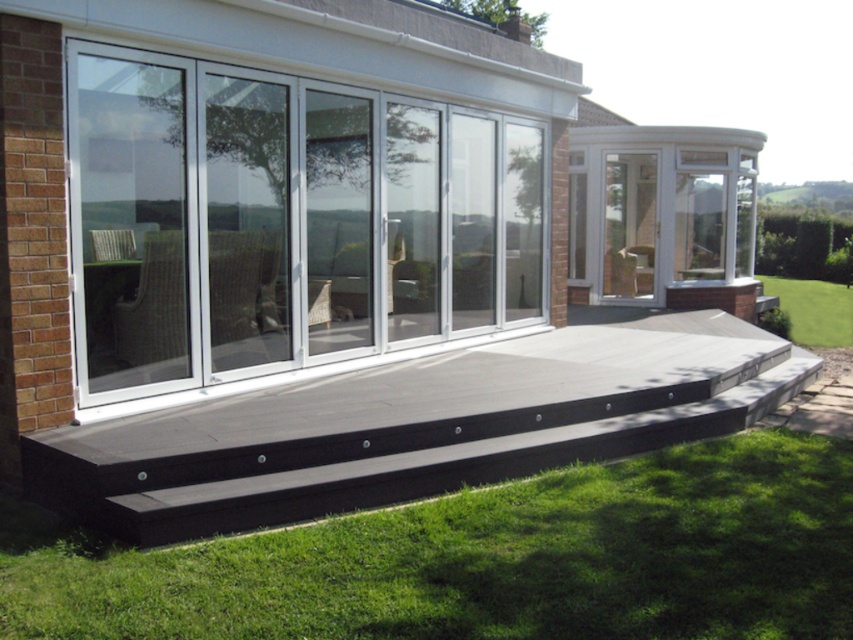
You are a delivery person trying to reach the front door of the house. You see the white aluminum sliding door at center and the green grass at lower right. Which object is closer to the front door?

The white aluminum sliding door at center is closer to the front door because it is located above the green grass at lower right, indicating it is positioned higher up near the house entrance.